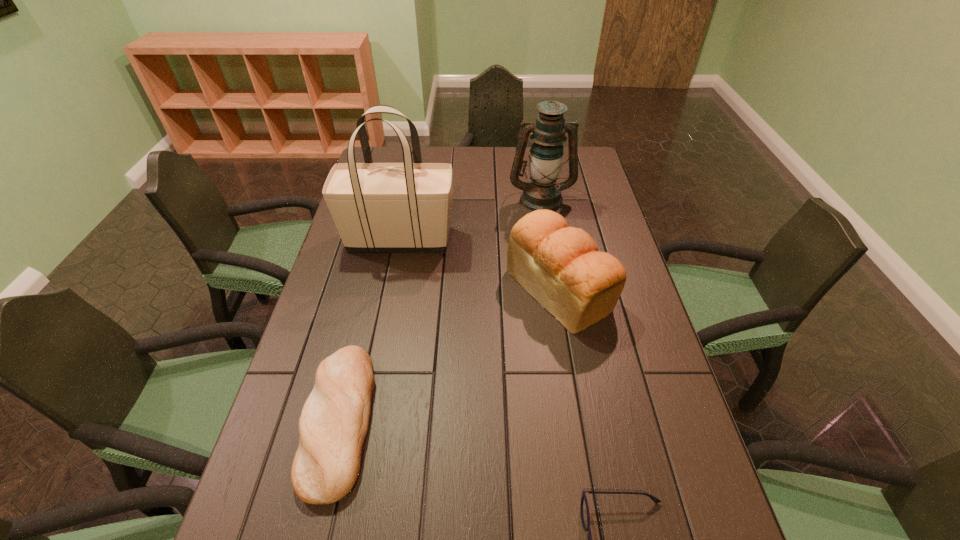
Where is `vacant space located on the back of the fourth tallest object`? The image size is (960, 540). vacant space located on the back of the fourth tallest object is located at coordinates (363, 322).

Find the location of a particular element. shopping bag present at the left edge is located at coordinates (377, 207).

What are the coordinates of `bread that is positioned at the left edge` in the screenshot? It's located at [333, 425].

You are a GUI agent. You are given a task and a screenshot of the screen. Output one action in this format:
    pyautogui.click(x=<x>, y=<y>)
    Task: Click on the oil lamp that is positioned at the right edge
    The height and width of the screenshot is (540, 960).
    Given the screenshot: What is the action you would take?
    pyautogui.click(x=546, y=156)

Locate an element on the screen. bread located at the right edge is located at coordinates click(x=560, y=266).

Locate an element on the screen. vacant space at the far edge of the desktop is located at coordinates (526, 150).

Image resolution: width=960 pixels, height=540 pixels. In the image, there is a desktop. Identify the location of vacant space at the left edge. coord(367,255).

In the image, there is a desktop. Where is `free space at the right edge`? The image size is (960, 540). free space at the right edge is located at coordinates (636, 461).

Identify the location of free spot between the left bread and the tallest object. The height and width of the screenshot is (540, 960). (370, 329).

What are the coordinates of `the fourth closest object to the left bread` in the screenshot? It's located at [x=546, y=156].